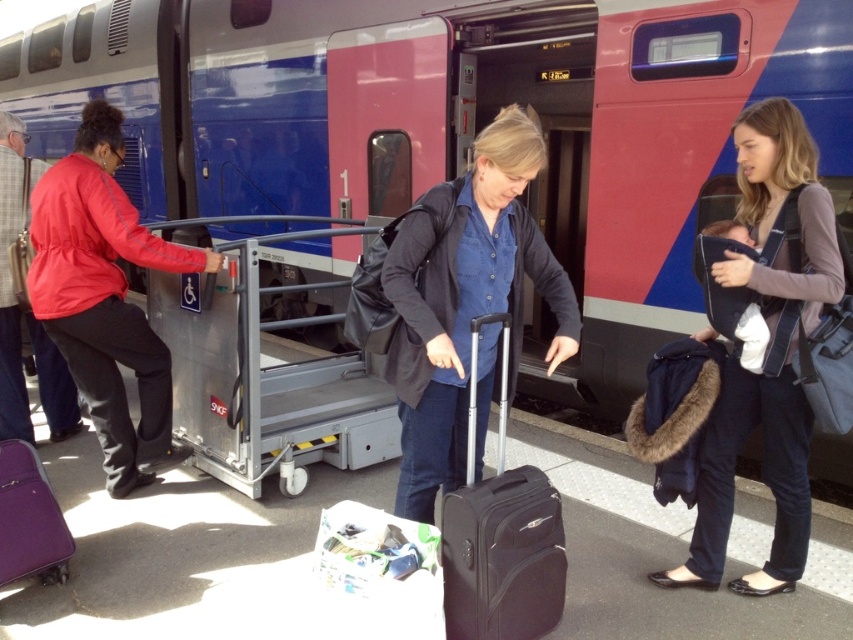
What is the object located at the coordinates point (x=465, y=300) in the image?

The point (x=465, y=300) marks the denim shirt at center.

You are a passenger at the train station and you see the dark blue jeans at center and the black hardshell suitcase at center. Which one takes up more space in the boarding area?

The dark blue jeans at center has a larger size compared to the black hardshell suitcase at center, so it takes up more space in the boarding area.

You are an observer at the train station. You notice two items at the center of the scene. One is dark blue jeans at center and the other is black hardshell suitcase at center. Which item has a greater width?

The dark blue jeans at center might be wider than black hardshell suitcase at center according to the description.